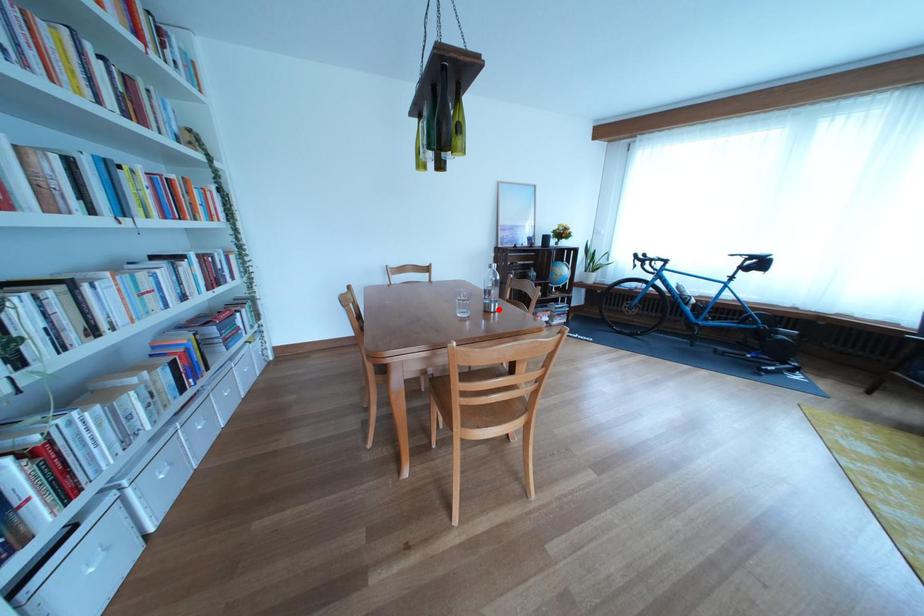
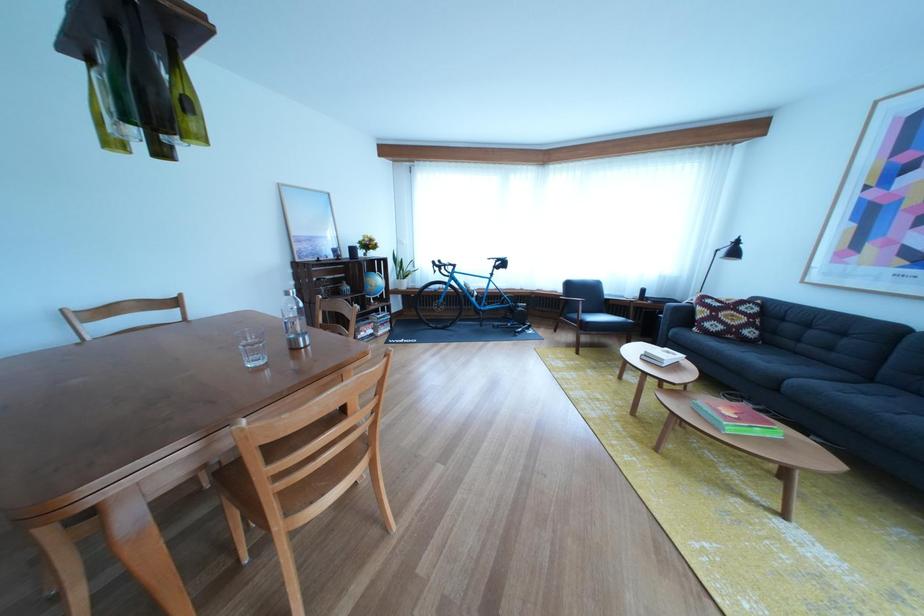
Find the pixel in the second image that matches the highlighted location in the first image.

(302, 346)